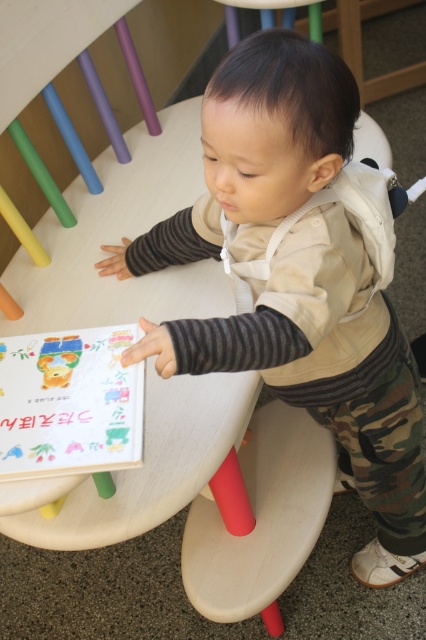
Can you confirm if smooth wood stool at lower center is positioned below matte plastic toy at lower left?

Yes.

Which is below, smooth wood stool at lower center or matte plastic toy at lower left?

smooth wood stool at lower center is lower down.

The width and height of the screenshot is (426, 640). What do you see at coordinates (259, 516) in the screenshot?
I see `smooth wood stool at lower center` at bounding box center [259, 516].

At what (x,y) coordinates should I click in order to perform the action: click on smooth wood stool at lower center. Please return your answer as a coordinate pair (x, y). This screenshot has width=426, height=640. Looking at the image, I should click on (259, 516).

Which is above, camouflage pants at lower right or smooth wood stool at lower center?

camouflage pants at lower right is above.

Does point (339, 161) come behind point (299, 483)?

No, (339, 161) is in front of (299, 483).

You are a GUI agent. You are given a task and a screenshot of the screen. Output one action in this format:
    pyautogui.click(x=<x>, y=<y>)
    Task: Click on the camouflage pants at lower right
    The height and width of the screenshot is (640, 426).
    Given the screenshot: What is the action you would take?
    pyautogui.click(x=325, y=374)

Who is lower down, camouflage pants at lower right or matte plastic toy at lower left?

camouflage pants at lower right is below.

Who is positioned more to the left, camouflage pants at lower right or matte plastic toy at lower left?

From the viewer's perspective, matte plastic toy at lower left appears more on the left side.

At what (x,y) coordinates should I click in order to perform the action: click on camouflage pants at lower right. Please return your answer as a coordinate pair (x, y). This screenshot has height=640, width=426. Looking at the image, I should click on (325, 374).